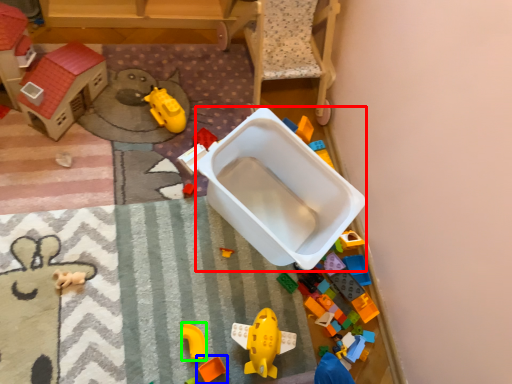
Question: Which object is the farthest from storage box (highlighted by a red box)? Choose among these: toy (highlighted by a blue box) or toy (highlighted by a green box).

Choices:
 (A) toy
 (B) toy

Answer: (A)